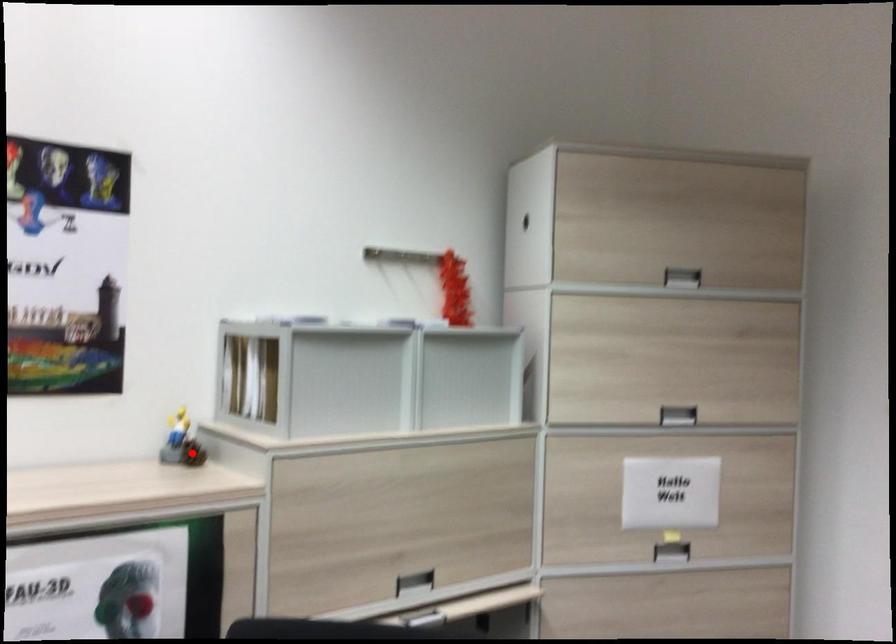
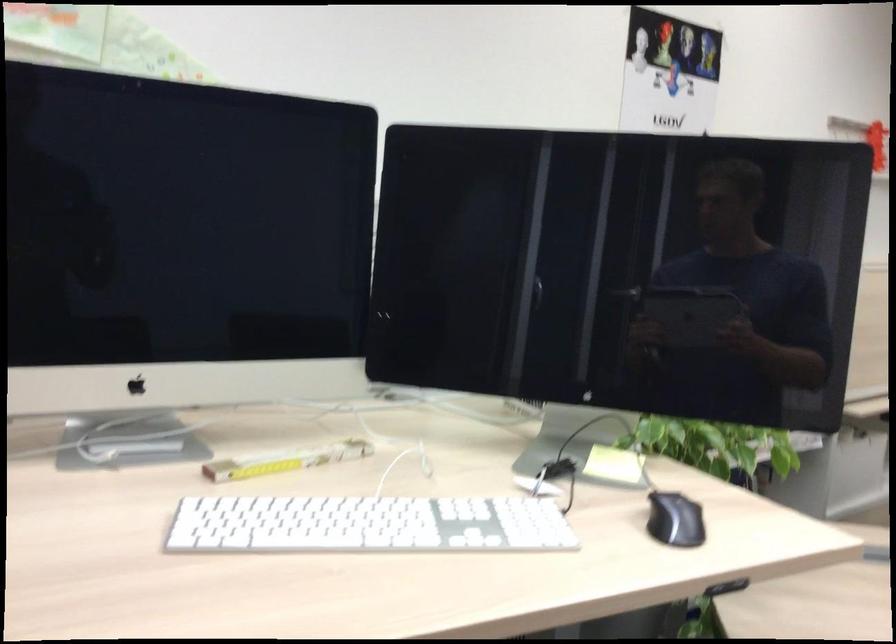
Question: I am providing you with two images of the same scene from different viewpoints. A red point is marked on the first image. Is the red point's position out of view in image 2?

Choices:
 (A) Yes
 (B) No

Answer: (A)